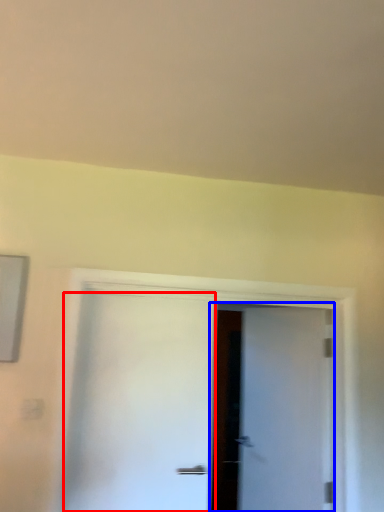
Question: Among these objects, which one is farthest to the camera, door (highlighted by a red box) or door (highlighted by a blue box)?

Choices:
 (A) door
 (B) door

Answer: (B)